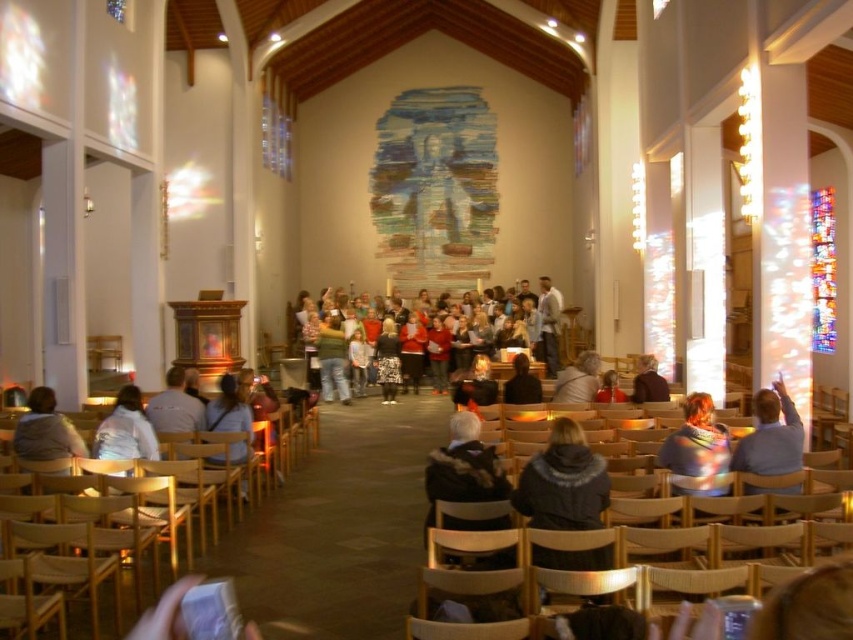
Question: Which point is closer to the camera?

Choices:
 (A) (517, 324)
 (B) (552, 451)

Answer: (B)

Question: Based on their relative distances, which object is nearer to the light gray sweater at lower left?

Choices:
 (A) fuzzy gray scarf at center
 (B) multicolored scarf at center

Answer: (A)

Question: Observing the image, what is the correct spatial positioning of fuzzy gray scarf at center in reference to blue sweater at right?

Choices:
 (A) left
 (B) right

Answer: (A)

Question: Is fuzzy gray scarf at center smaller than dark gray sweater at center?

Choices:
 (A) no
 (B) yes

Answer: (B)

Question: Is fuzzy gray scarf at center smaller than multicolored scarf at center?

Choices:
 (A) no
 (B) yes

Answer: (A)

Question: Which of the following is the closest to the observer?

Choices:
 (A) dark gray sweater at center
 (B) matte brown jacket at lower right

Answer: (B)